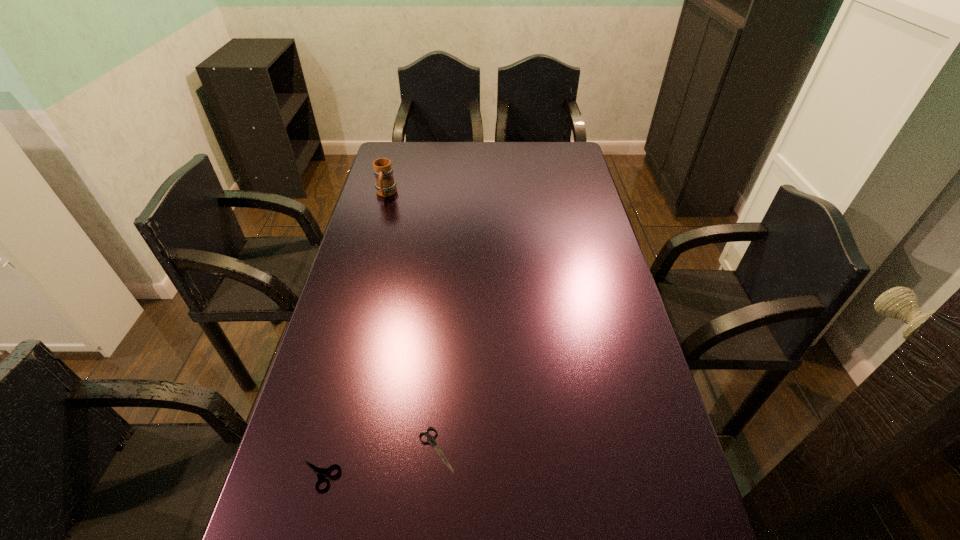
Find the location of `the tallest object`. the tallest object is located at coordinates (385, 185).

Identify the location of mug. (385, 185).

You are a GUI agent. You are given a task and a screenshot of the screen. Output one action in this format:
    pyautogui.click(x=<x>, y=<y>)
    Task: Click on the second tallest object
    The width and height of the screenshot is (960, 540).
    Given the screenshot: What is the action you would take?
    pyautogui.click(x=320, y=472)

Identify the location of the taller shears. This screenshot has width=960, height=540. (320, 472).

At what (x,y) coordinates should I click in order to perform the action: click on the right shears. Please return your answer as a coordinate pair (x, y). Image resolution: width=960 pixels, height=540 pixels. Looking at the image, I should click on (430, 439).

This screenshot has height=540, width=960. Find the location of `the shorter shears`. the shorter shears is located at coordinates (430, 439).

You are a GUI agent. You are given a task and a screenshot of the screen. Output one action in this format:
    pyautogui.click(x=<x>, y=<y>)
    Task: Click on the vacant region located 0.110m on the side of the tallest object with the handle
    The height and width of the screenshot is (540, 960).
    Given the screenshot: What is the action you would take?
    pyautogui.click(x=378, y=220)

I want to click on vacant space located on the back of the left shears, so click(x=346, y=375).

Find the location of a particular element. This screenshot has height=540, width=960. vacant region located 0.160m on the back of the rightmost object is located at coordinates (443, 367).

Identify the location of mug at the left edge. The image size is (960, 540). (385, 185).